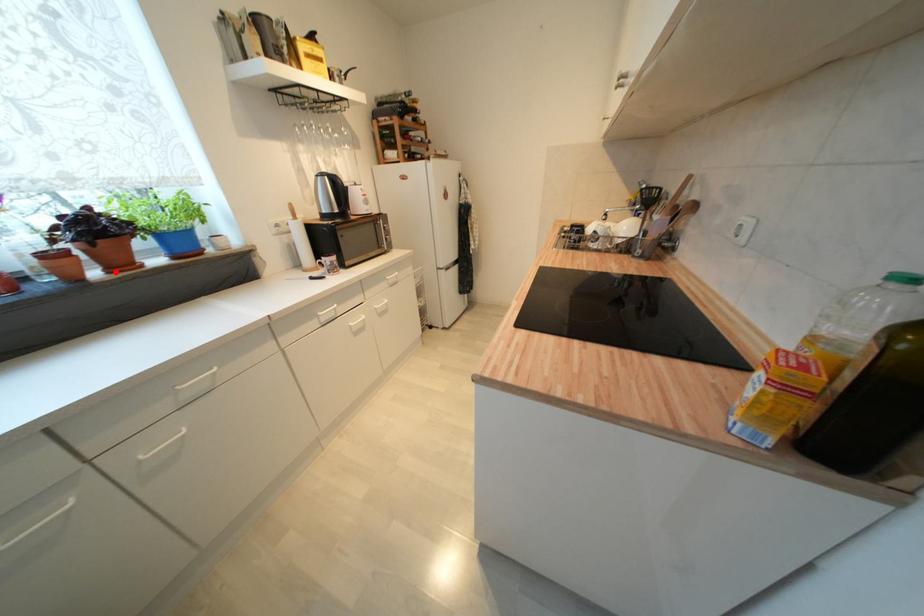
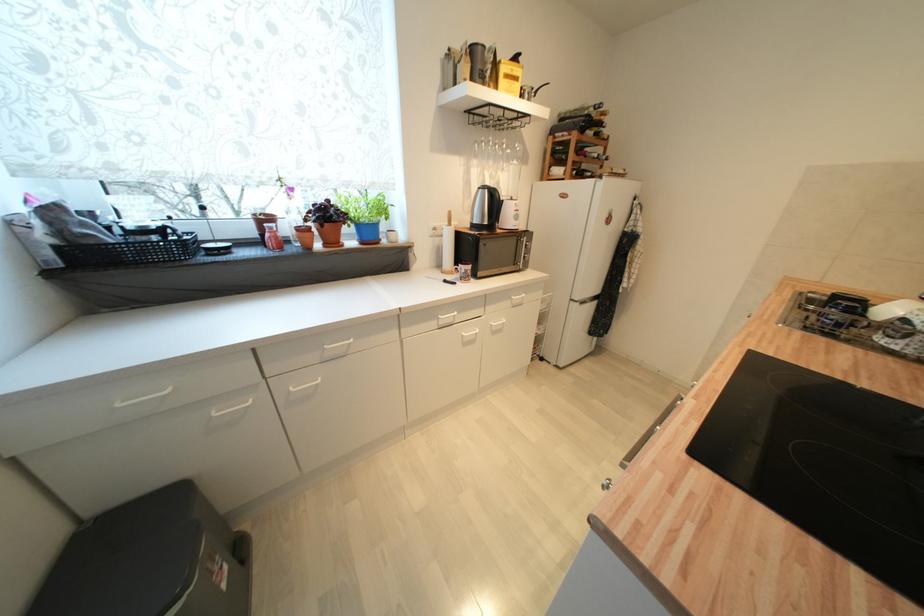
In the second image, find the point that corresponds to the highlighted location in the first image.

(331, 246)